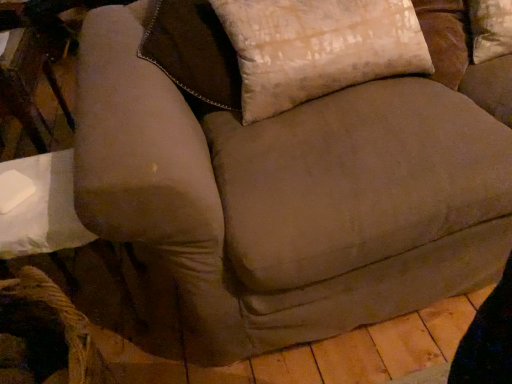
Locate an element on the screen. The image size is (512, 384). satin beige pillow at upper center is located at coordinates (318, 48).

What do you see at coordinates (318, 48) in the screenshot? I see `satin beige pillow at upper center` at bounding box center [318, 48].

At what (x,y) coordinates should I click in order to perform the action: click on satin beige pillow at upper center. Please return your answer as a coordinate pair (x, y). Looking at the image, I should click on (318, 48).